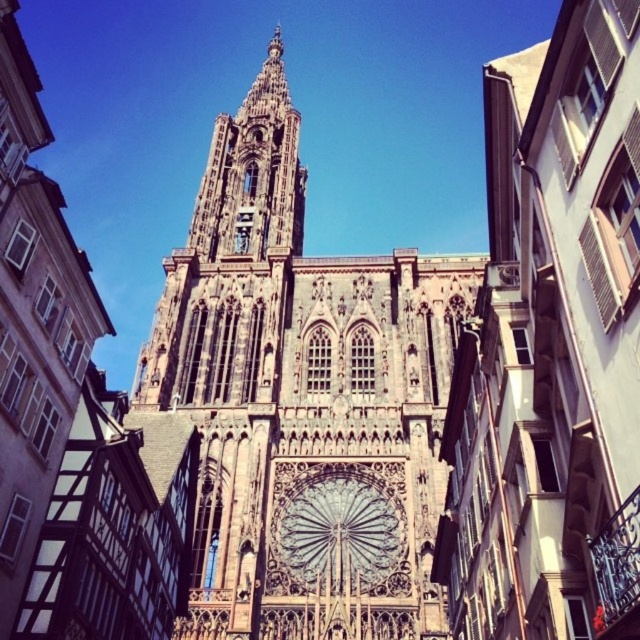
Question: Does brown stone tower at center come in front of brown stone rose window at center?

Choices:
 (A) yes
 (B) no

Answer: (A)

Question: Does brown stone tower at center appear on the right side of brown stone rose window at center?

Choices:
 (A) yes
 (B) no

Answer: (B)

Question: Which object is farther from the camera taking this photo?

Choices:
 (A) brown stone rose window at center
 (B) brown stone tower at center

Answer: (A)

Question: Which point is closer to the camera?

Choices:
 (A) (253, 493)
 (B) (369, 493)

Answer: (A)

Question: Is brown stone tower at center thinner than brown stone rose window at center?

Choices:
 (A) no
 (B) yes

Answer: (A)

Question: Which point appears closest to the camera in this image?

Choices:
 (A) (368, 577)
 (B) (200, 528)

Answer: (A)